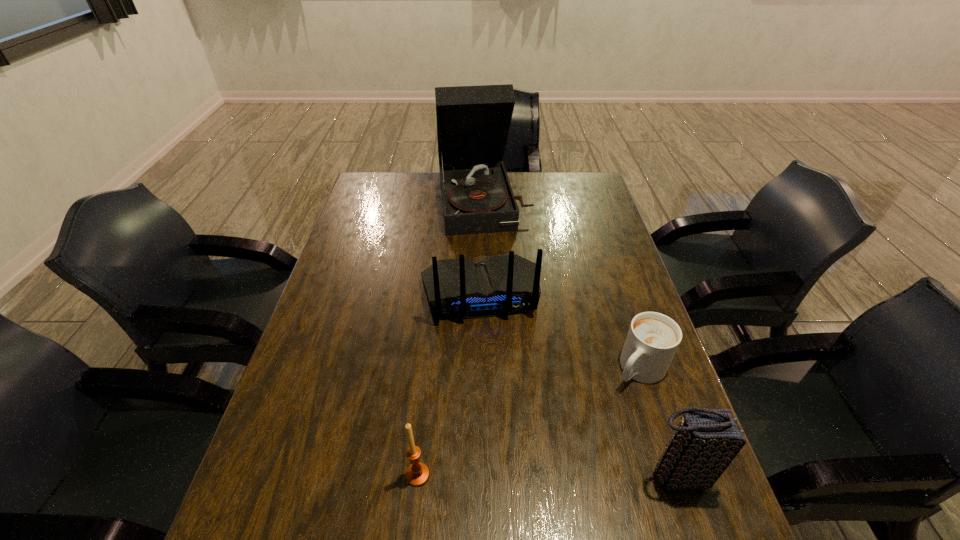
At what (x,y) coordinates should I click in order to perform the action: click on vacant space on the desktop that is between the candle_holder and the clutch bag and is positioned on the side with the handle of the third nearest object. Please return your answer as a coordinate pair (x, y). This screenshot has width=960, height=540. Looking at the image, I should click on (544, 475).

Identify the location of vacant space on the desktop that is between the candle_holder and the clutch bag and is positioned on the back of the router. (509, 475).

Find the location of a particular element. Image resolution: width=960 pixels, height=540 pixels. vacant space on the desktop that is between the candle_holder and the clutch bag and is positioned on the front-facing side of the tallest object is located at coordinates (545, 475).